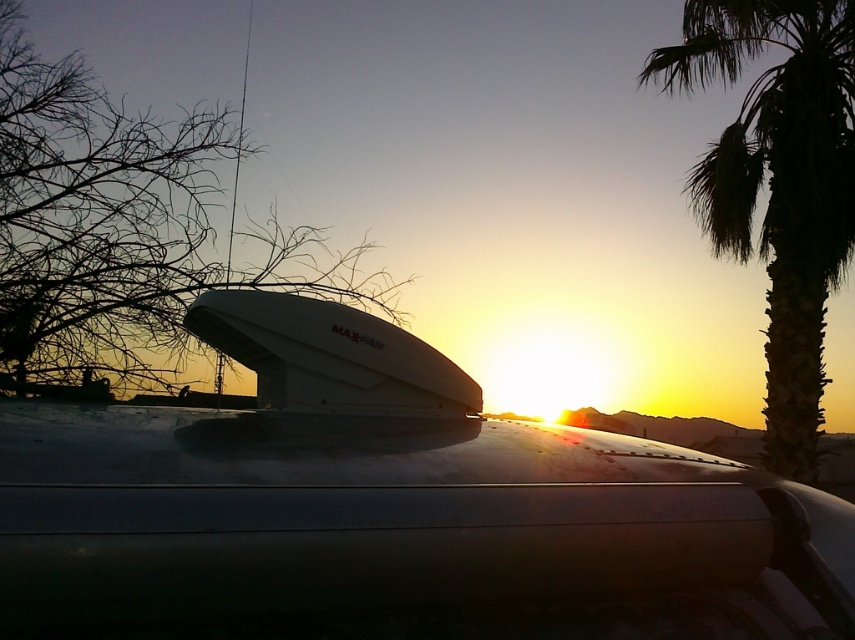
Does bare branches at upper left have a greater width compared to green leafy palm tree at right?

Correct, the width of bare branches at upper left exceeds that of green leafy palm tree at right.

Between point (90, 93) and point (738, 221), which one is positioned behind?

The point (738, 221) is more distant.

I want to click on bare branches at upper left, so click(x=124, y=225).